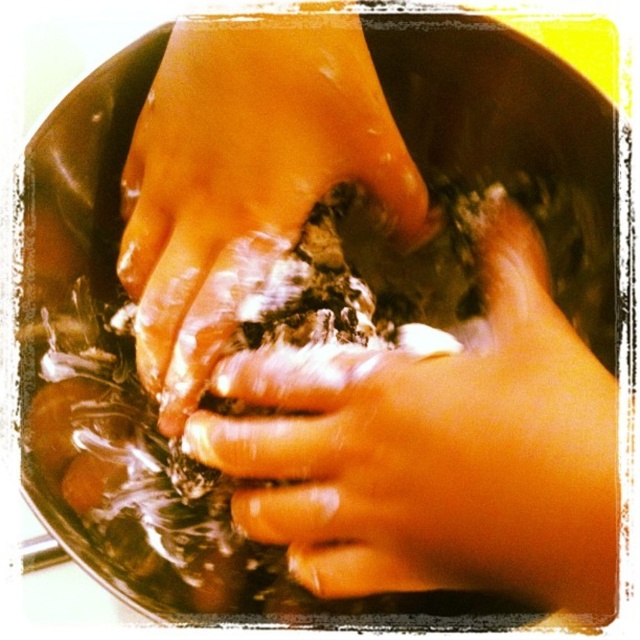
Who is higher up, smooth skin hands at center or dry skin at center?

dry skin at center is higher up.

Between point (561, 548) and point (349, 42), which one is positioned in front?

Point (561, 548) is in front.

You are a GUI agent. You are given a task and a screenshot of the screen. Output one action in this format:
    pyautogui.click(x=<x>, y=<y>)
    Task: Click on the smooth skin hands at center
    Image resolution: width=640 pixels, height=640 pixels.
    Given the screenshot: What is the action you would take?
    pyautogui.click(x=436, y=451)